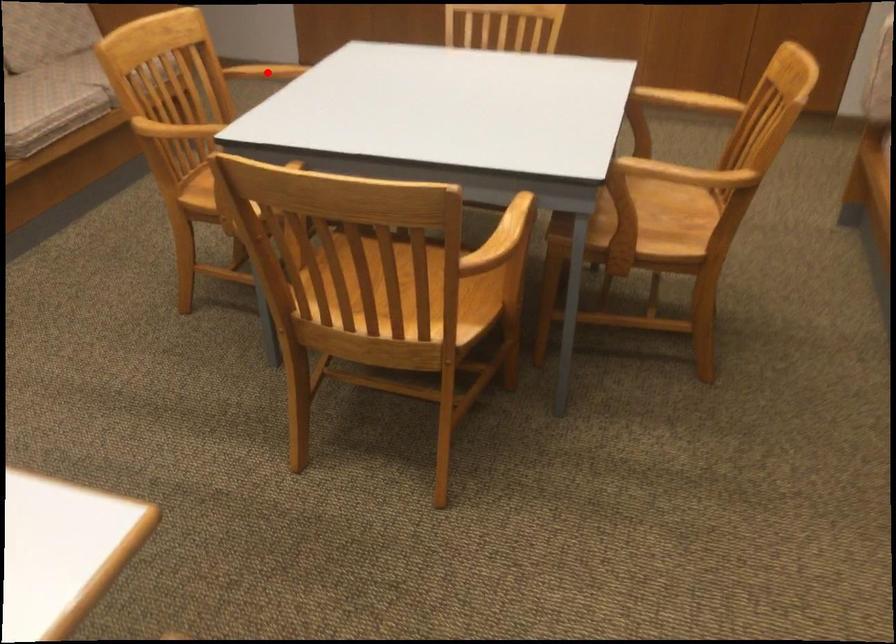
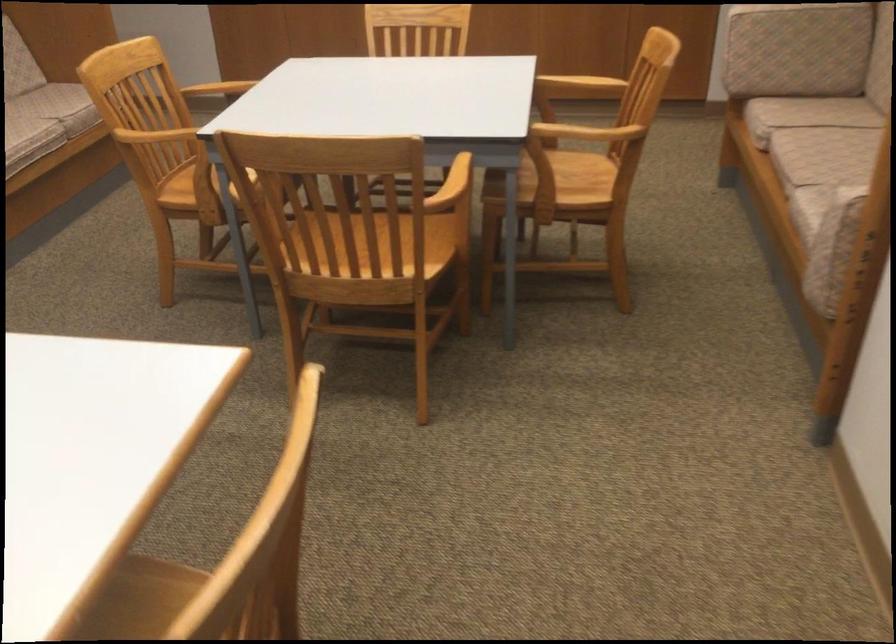
The point at the highlighted location is marked in the first image. Where is the corresponding point in the second image?

(218, 89)